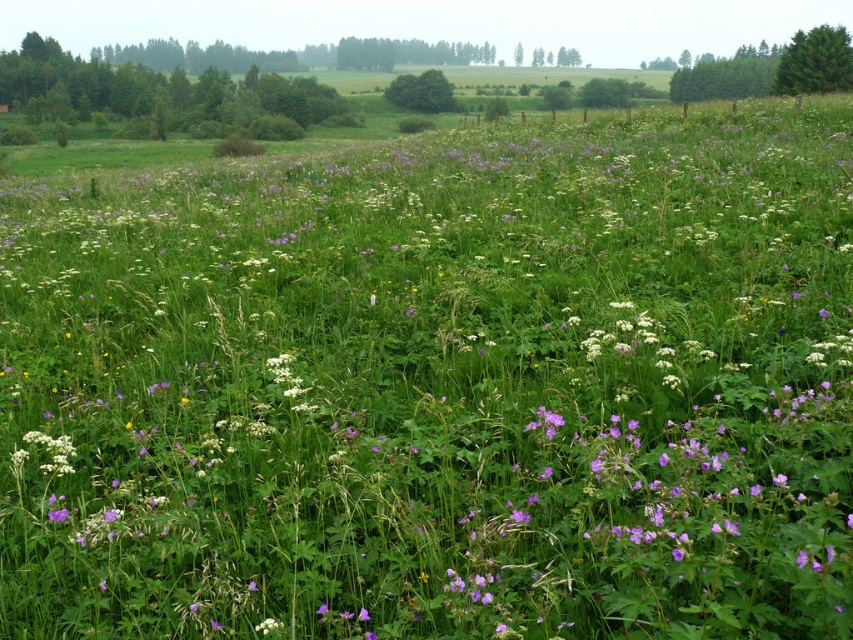
Who is shorter, green matte tree at upper right or green leafy tree at center?

With less height is green leafy tree at center.

Consider the image. Who is lower down, green matte tree at upper right or green leafy tree at center?

green matte tree at upper right is below.

Identify the location of green matte tree at upper right. Image resolution: width=853 pixels, height=640 pixels. (815, 61).